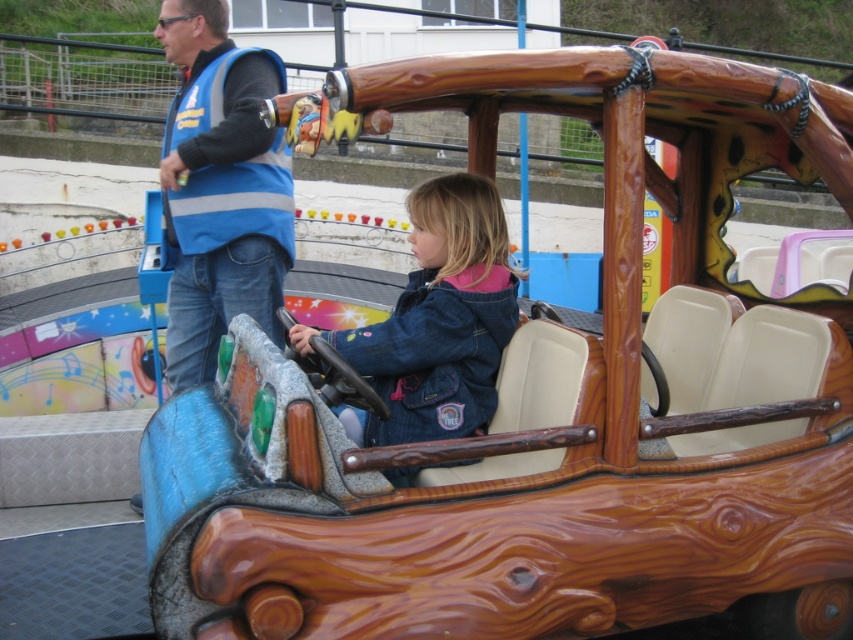
You are a safety inspector at the fairground. You need to check if the safety harness is properly attached to the ride. The safety harness is located at point (219, 188). Is this point on the blue reflective vest at upper left?

Yes, the point (219, 188) is on the blue reflective vest at upper left, so the safety harness is attached there.

You are a visitor at the fairground. You see the blue reflective vest at upper left and the denim jacket at center. Which one is positioned to the left?

The blue reflective vest at upper left is positioned to the left of the denim jacket at center.